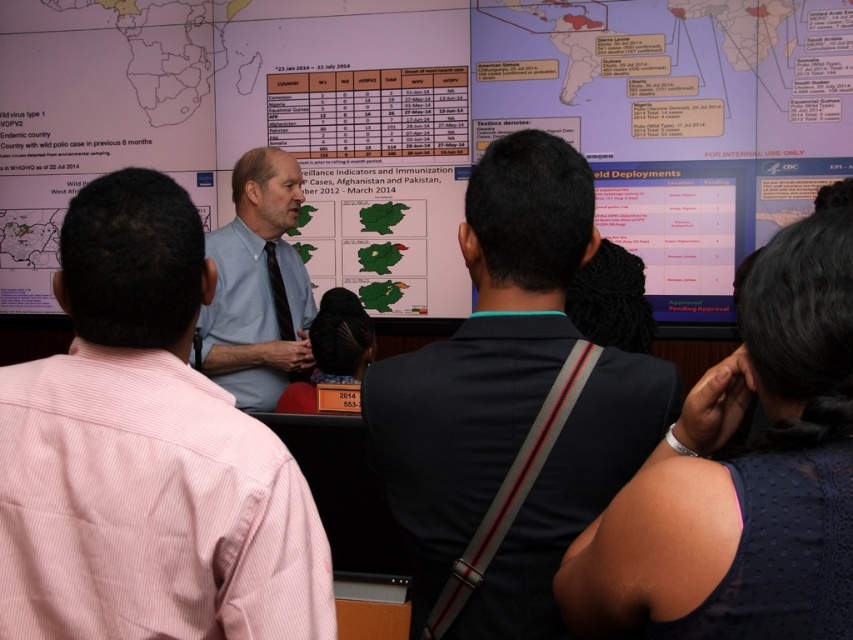
Consider the image. What is located at the coordinates point (430, 122) in the image?

The point (430, 122) corresponds to the matte paper map at upper center.

You are a presenter standing at the podium. You need to point to the matte paper map at upper center while addressing the audience wearing the light blue shirt at center. Can you reach the map from your current position without moving?

The distance between the matte paper map at upper center and the light blue shirt at center is 2.73 meters. Since you are standing at the podium, you can likely reach the map with your arm or a pointer without needing to move closer, as 2.73 meters is a reasonable distance for gesturing towards an object while addressing an audience.